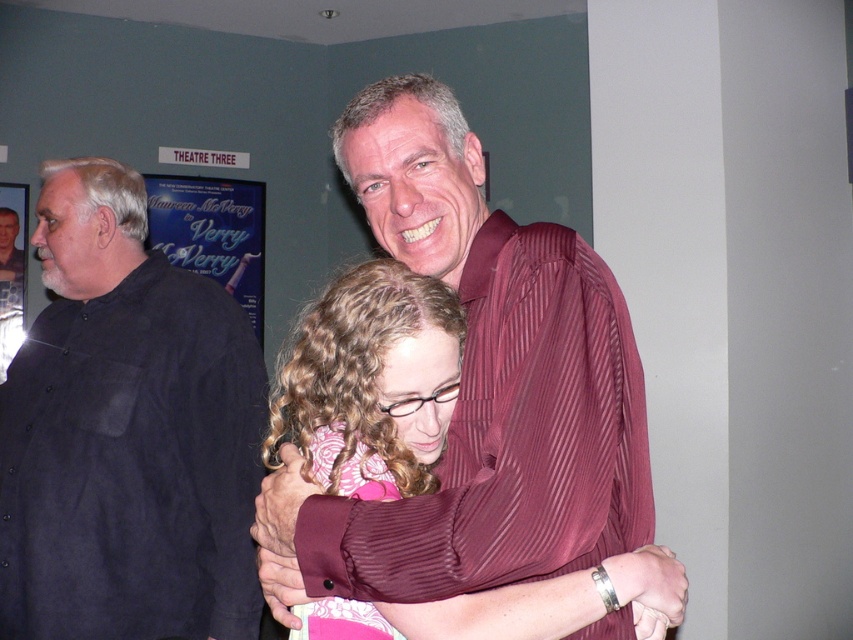
You are designing a seating arrangement for a small theater event and need to place two items on a shelf. The items are the black matte shirt at left and the pink fabric at center. According to the image, which item requires more horizontal space?

The black matte shirt at left requires more horizontal space because its width surpasses that of the pink fabric at center.

In the theater scene, there are two people in focus and a third person in the background. The two main individuals are the person in a maroon striped shirt embracing someone in a pink top, and the third person is marked by the point at (126, 433). Which of the three people is wearing a dark blue shirt?

The point at (126, 433) marks the black matte shirt at left, so the third person in the background wearing a dark blue shirt is not among the marked objects. However, according to the scene description, there is another individual in a dark blue shirt to the left, so the answer is that the third person in the background is wearing the dark blue shirt.